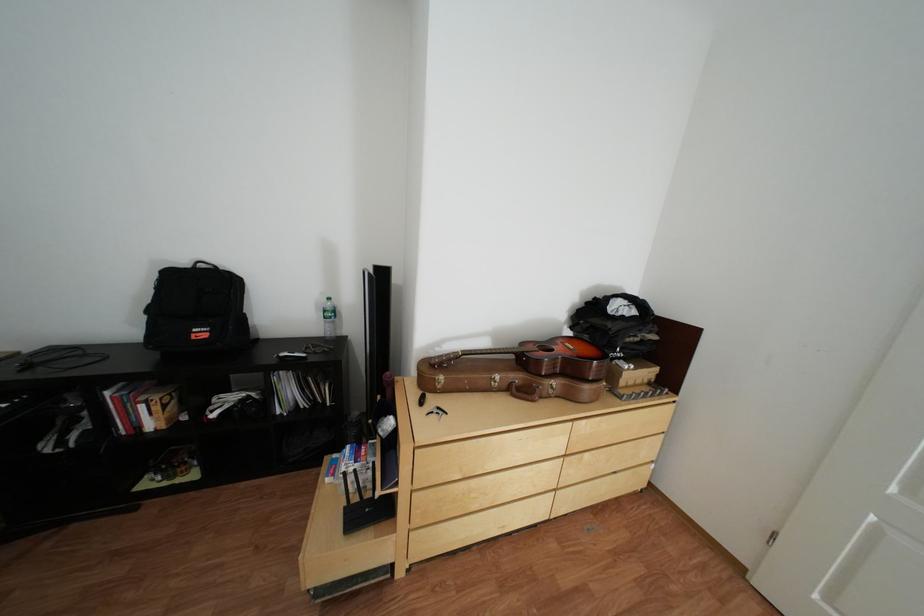
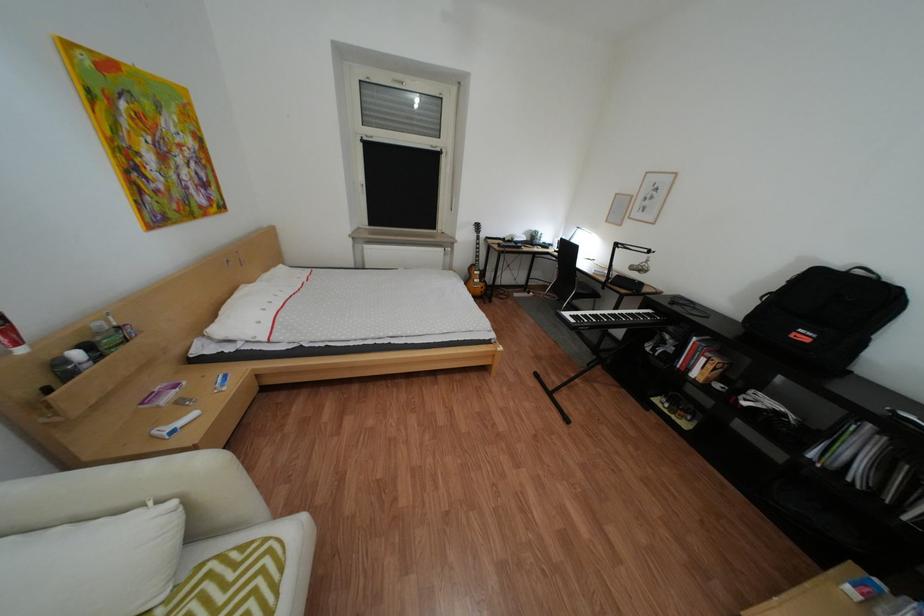
How did the camera likely rotate?

The camera rotated toward left-down.